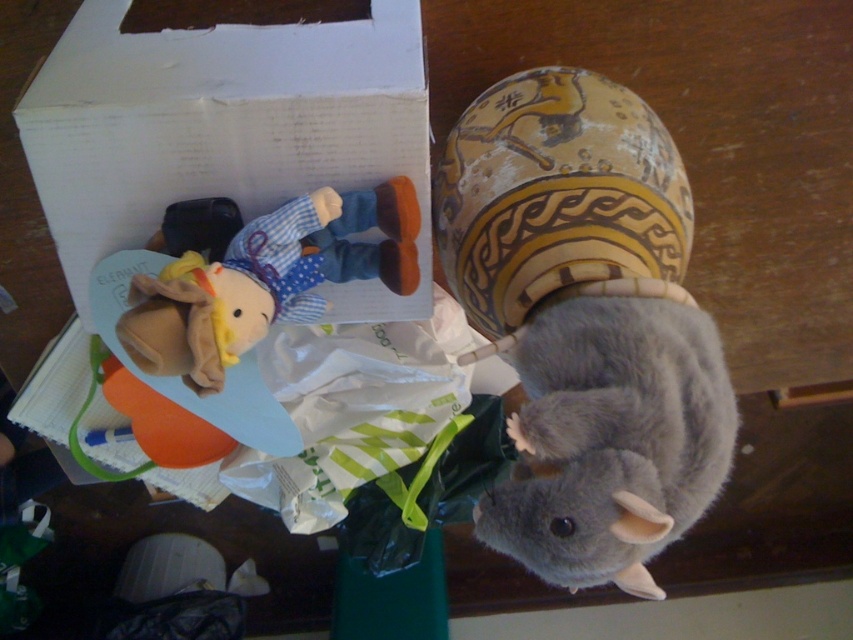
Can you confirm if white cardboard box at upper left is positioned above gray soft plush at lower right?

Yes.

Can you confirm if white cardboard box at upper left is positioned below gray soft plush at lower right?

No, white cardboard box at upper left is not below gray soft plush at lower right.

In order to click on white cardboard box at upper left in this screenshot , I will do `click(224, 131)`.

Which is more to the right, fluffy yellow plush at center or fluffy gray mouse at lower right?

From the viewer's perspective, fluffy gray mouse at lower right appears more on the right side.

Which is more to the left, fluffy yellow plush at center or fluffy gray mouse at lower right?

fluffy yellow plush at center is more to the left.

Is point (303, 268) positioned after point (566, 572)?

Yes, point (303, 268) is behind point (566, 572).

Locate an element on the screen. fluffy yellow plush at center is located at coordinates (270, 280).

Who is lower down, white cardboard box at upper left or fluffy gray mouse at lower right?

Positioned lower is fluffy gray mouse at lower right.

Between point (131, 118) and point (606, 451), which one is positioned in front?

Positioned in front is point (606, 451).

Image resolution: width=853 pixels, height=640 pixels. Find the location of `white cardboard box at upper left`. white cardboard box at upper left is located at coordinates (224, 131).